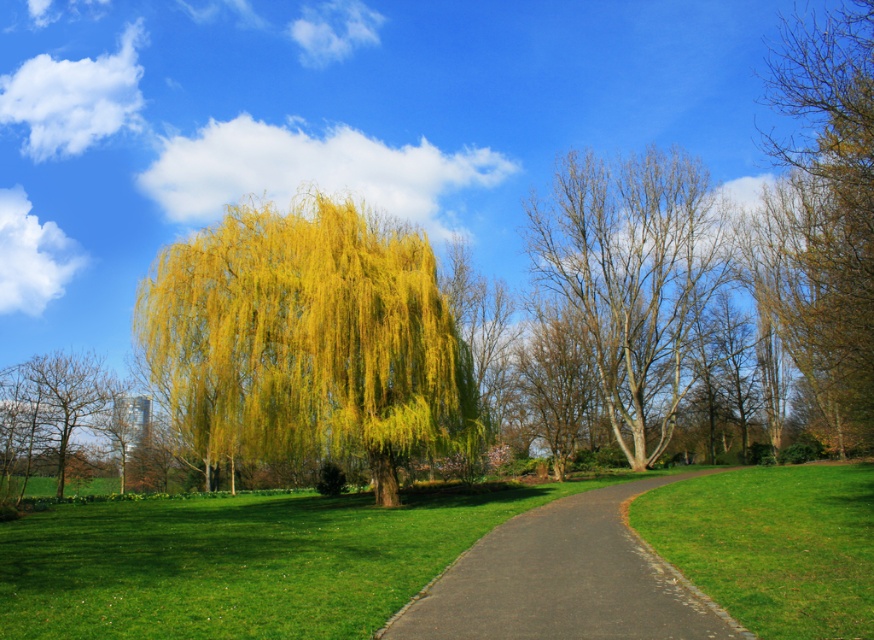
Consider the image. Can you confirm if bare wood tree at center is positioned above black asphalt path at center?

Yes, bare wood tree at center is above black asphalt path at center.

The height and width of the screenshot is (640, 874). Describe the element at coordinates (633, 278) in the screenshot. I see `bare wood tree at center` at that location.

Find the location of `bare wood tree at center`. bare wood tree at center is located at coordinates (633, 278).

Where is `bare wood tree at center`? bare wood tree at center is located at coordinates (633, 278).

Does point (643, 490) come behind point (836, 556)?

Yes, it is.

Is black asphalt path at center smaller than green grass at lower right?

Yes, black asphalt path at center is smaller than green grass at lower right.

Locate an element on the screen. The image size is (874, 640). black asphalt path at center is located at coordinates (565, 579).

Locate an element on the screen. The image size is (874, 640). black asphalt path at center is located at coordinates (565, 579).

Can you confirm if yellow-green foliage at center is positioned below bare wood tree at center?

Correct, yellow-green foliage at center is located below bare wood tree at center.

Is yellow-green foliage at center wider than bare wood tree at center?

Incorrect, yellow-green foliage at center's width does not surpass bare wood tree at center's.

The image size is (874, 640). I want to click on yellow-green foliage at center, so click(x=307, y=339).